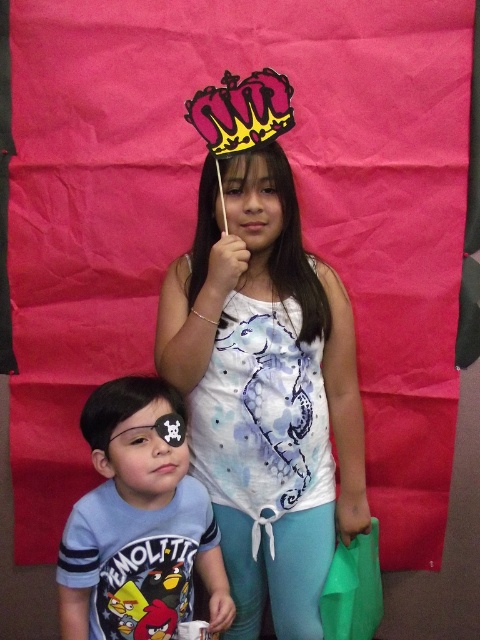
Question: Is matte white tank top at center below blue cotton shirt at lower left?

Choices:
 (A) no
 (B) yes

Answer: (A)

Question: Considering the relative positions of matte white tank top at center and blue cotton shirt at lower left in the image provided, where is matte white tank top at center located with respect to blue cotton shirt at lower left?

Choices:
 (A) right
 (B) left

Answer: (A)

Question: Is matte white tank top at center smaller than blue cotton shirt at lower left?

Choices:
 (A) yes
 (B) no

Answer: (B)

Question: Which of the following is the closest to the observer?

Choices:
 (A) blue cotton shirt at lower left
 (B) matte white tank top at center

Answer: (A)